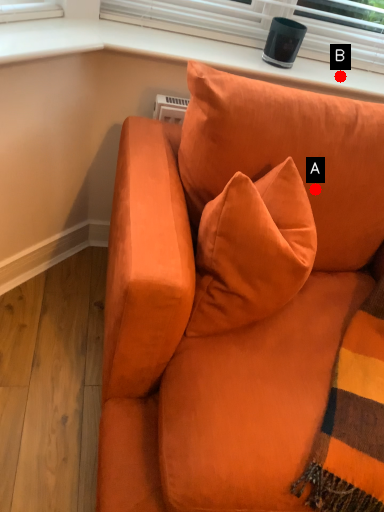
Question: Two points are circled on the image, labeled by A and B beside each circle. Which of the following is the closest to the observer?

Choices:
 (A) A is closer
 (B) B is closer

Answer: (A)